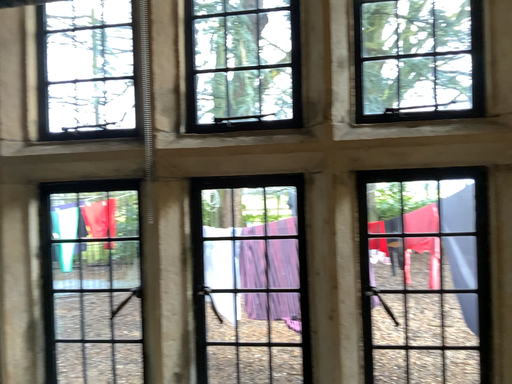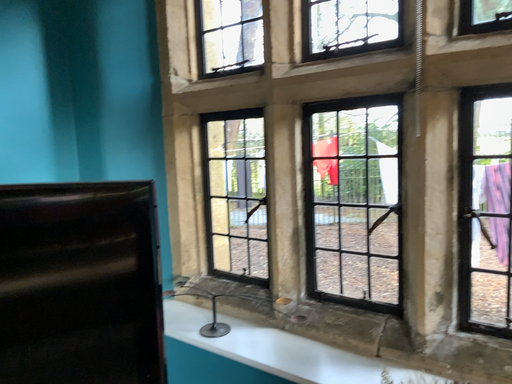
Question: Which way did the camera rotate in the video?

Choices:
 (A) rotated upward
 (B) rotated downward

Answer: (B)